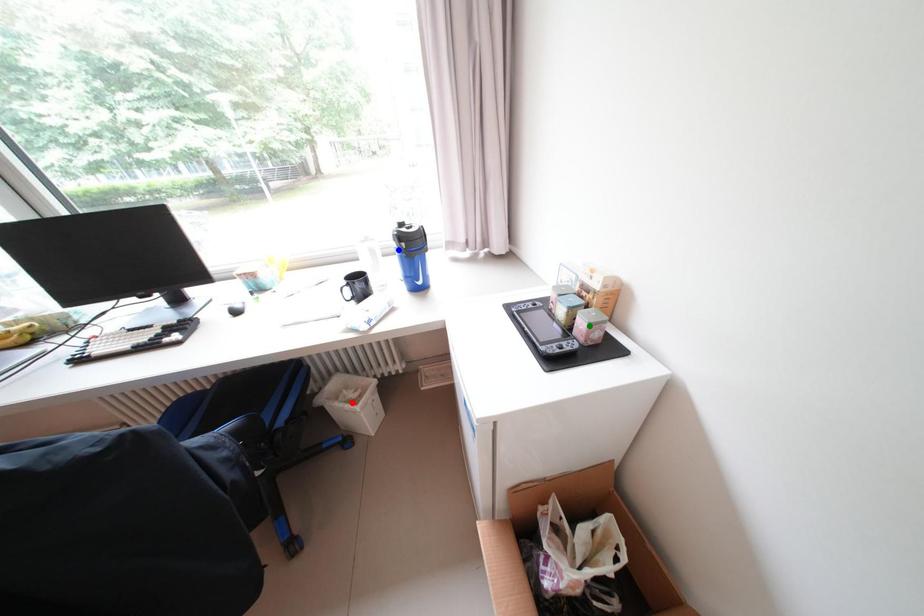
Order these from nearest to farthest:
1. green point
2. blue point
3. red point

green point → blue point → red point